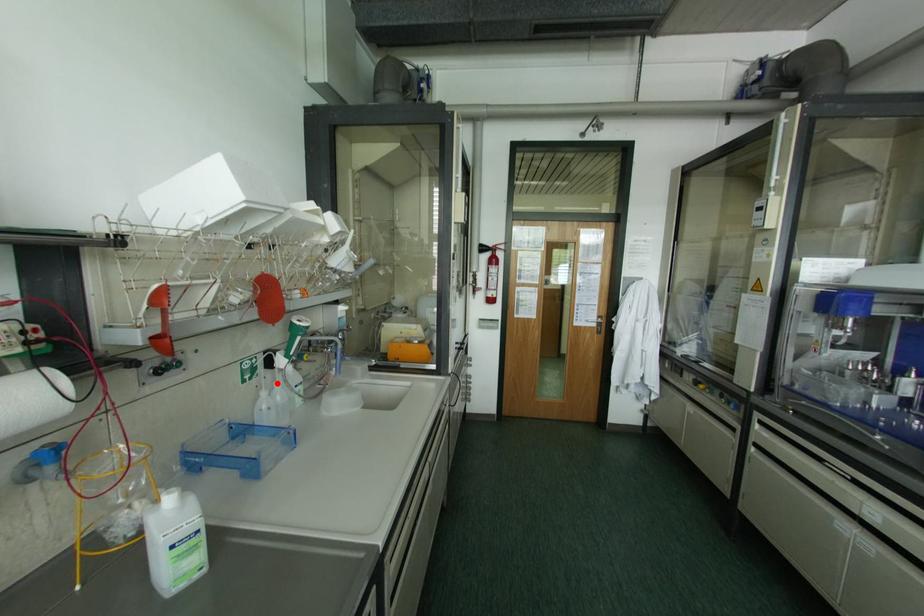
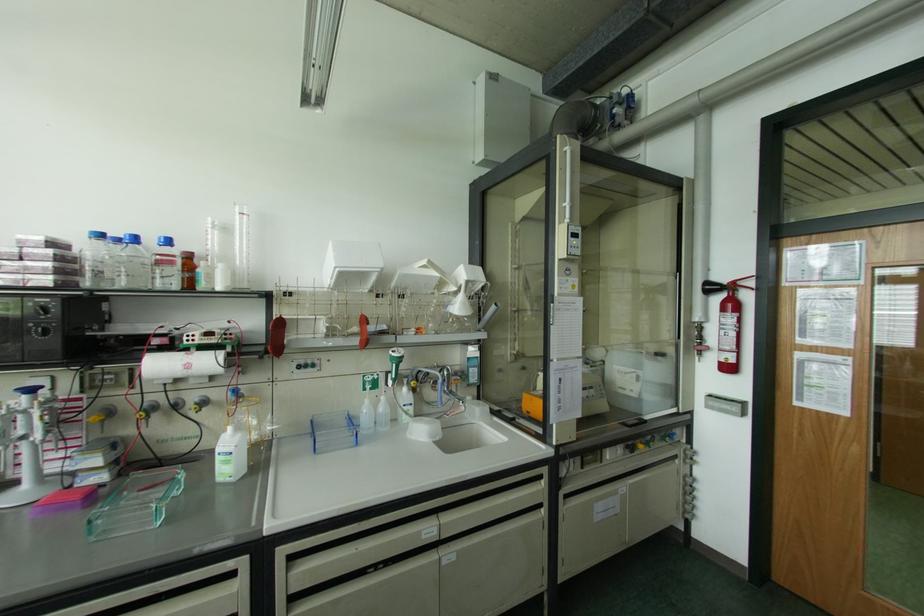
The point at the highlighted location is marked in the first image. Where is the corresponding point in the second image?

(382, 398)